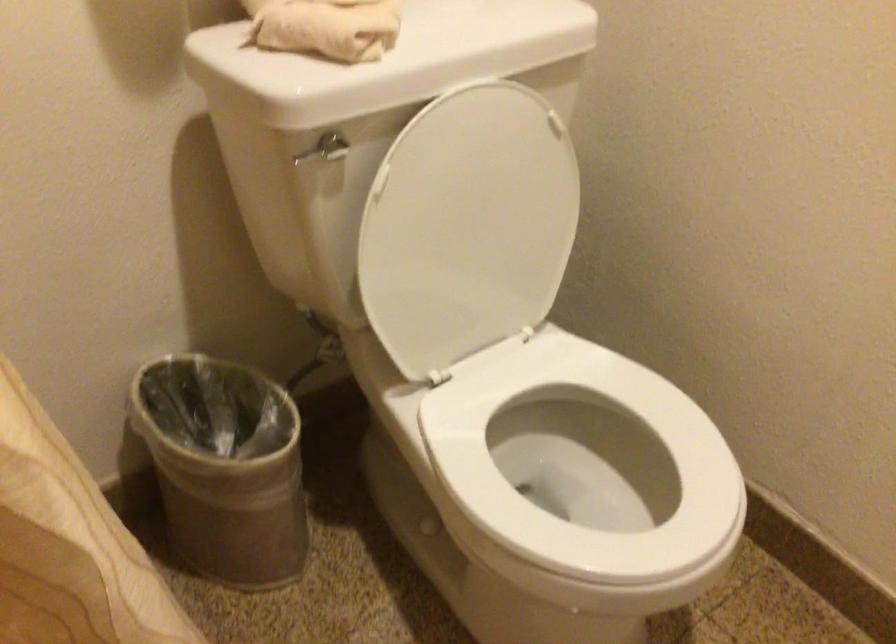
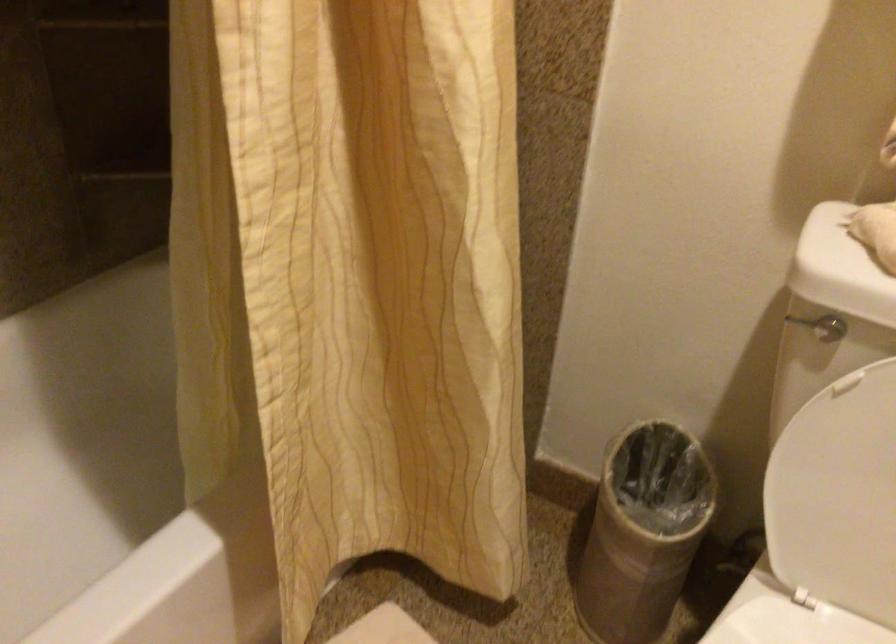
Find the pixel in the second image that matches (273,460) in the first image.

(643, 532)